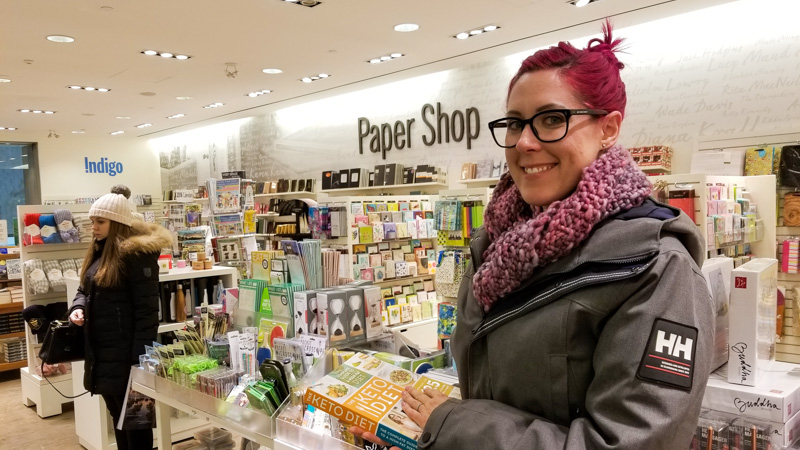
This screenshot has width=800, height=450. In order to click on ceiling in this screenshot , I will do `click(301, 21)`.